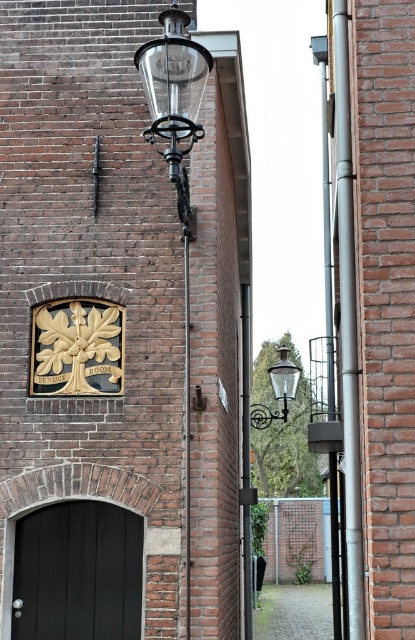
Question: Which of these objects is positioned farthest from the matte black door at lower left?

Choices:
 (A) paved stone alley at lower center
 (B) clear glass lamp post at upper left
 (C) matte glass lamp at upper center

Answer: (A)

Question: Can you confirm if matte black door at lower left is smaller than clear glass lamp post at upper left?

Choices:
 (A) yes
 (B) no

Answer: (A)

Question: Which object appears closest to the camera in this image?

Choices:
 (A) matte black door at lower left
 (B) matte glass lamp at upper center
 (C) clear glass lamp post at upper left

Answer: (C)

Question: Can you confirm if matte black door at lower left is positioned below clear glass lamp post at upper left?

Choices:
 (A) no
 (B) yes

Answer: (B)

Question: Which is farther from the paved stone alley at lower center?

Choices:
 (A) clear glass lamp post at upper left
 (B) matte glass lamp at upper center

Answer: (A)

Question: Is matte black door at lower left thinner than matte glass lamp at upper center?

Choices:
 (A) no
 (B) yes

Answer: (B)